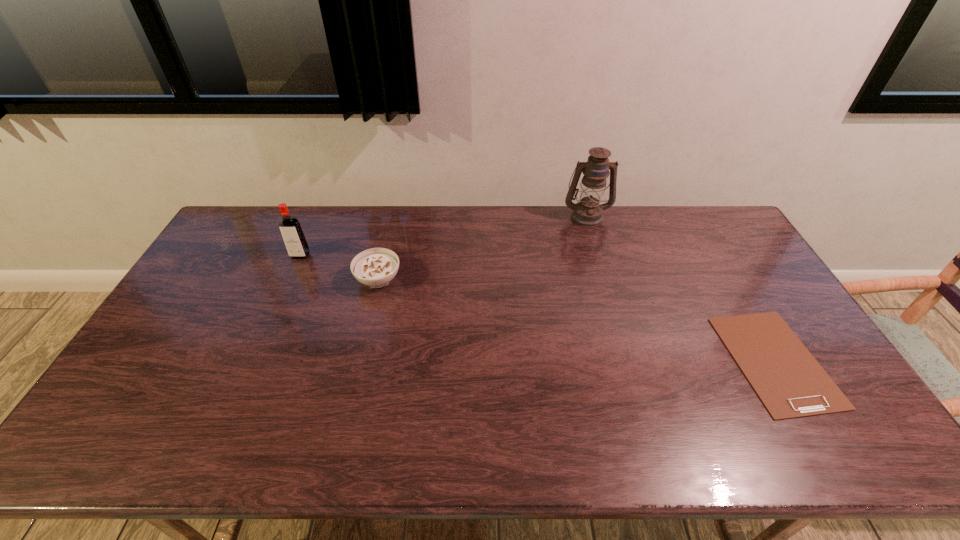
Identify the location of the tallest object. The image size is (960, 540). (588, 212).

Where is `oil lamp`? oil lamp is located at coordinates (588, 212).

Where is `the second farthest object`? The width and height of the screenshot is (960, 540). the second farthest object is located at coordinates (290, 228).

Where is `the second tallest object`? The height and width of the screenshot is (540, 960). the second tallest object is located at coordinates (290, 228).

What are the coordinates of `soup bowl` in the screenshot? It's located at (376, 267).

Identify the location of the second object from left to right. The height and width of the screenshot is (540, 960). (376, 267).

Locate an element on the screen. clipboard is located at coordinates (788, 380).

You are a GUI agent. You are given a task and a screenshot of the screen. Output one action in this format:
    pyautogui.click(x=<x>, y=<y>)
    Task: Click on the nearest object
    
    Given the screenshot: What is the action you would take?
    pyautogui.click(x=788, y=380)

Where is `blank space located 0.300m on the right of the tallest object`? blank space located 0.300m on the right of the tallest object is located at coordinates (689, 216).

This screenshot has width=960, height=540. I want to click on vacant space located on the front and back of the leftmost object, so click(x=263, y=339).